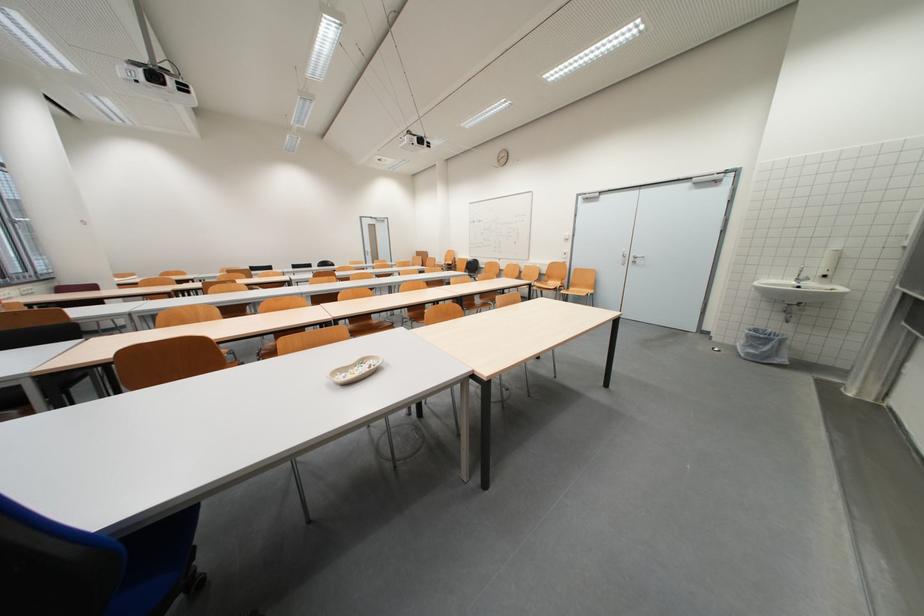
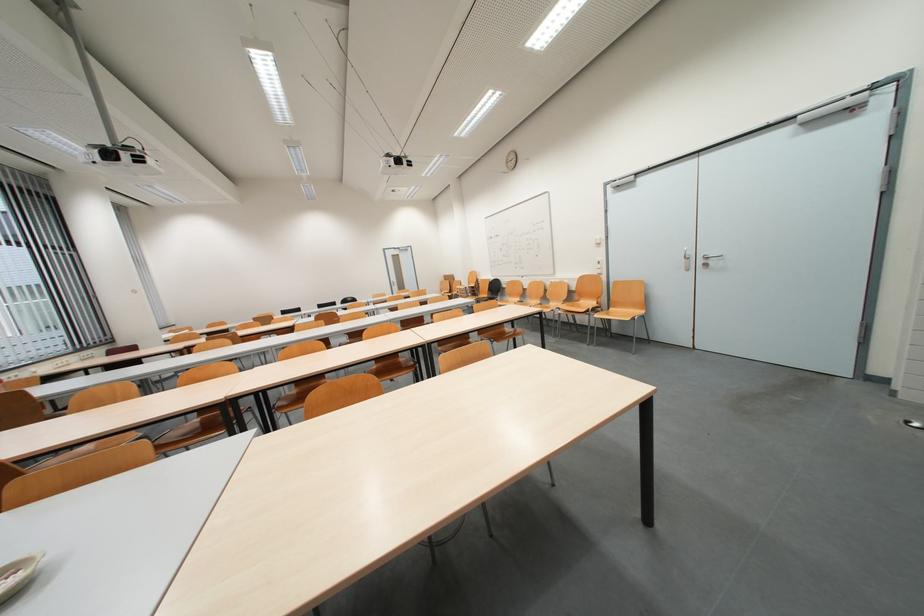
Where in the second image is the point corresponding to (x=370, y=366) from the first image?

(10, 578)